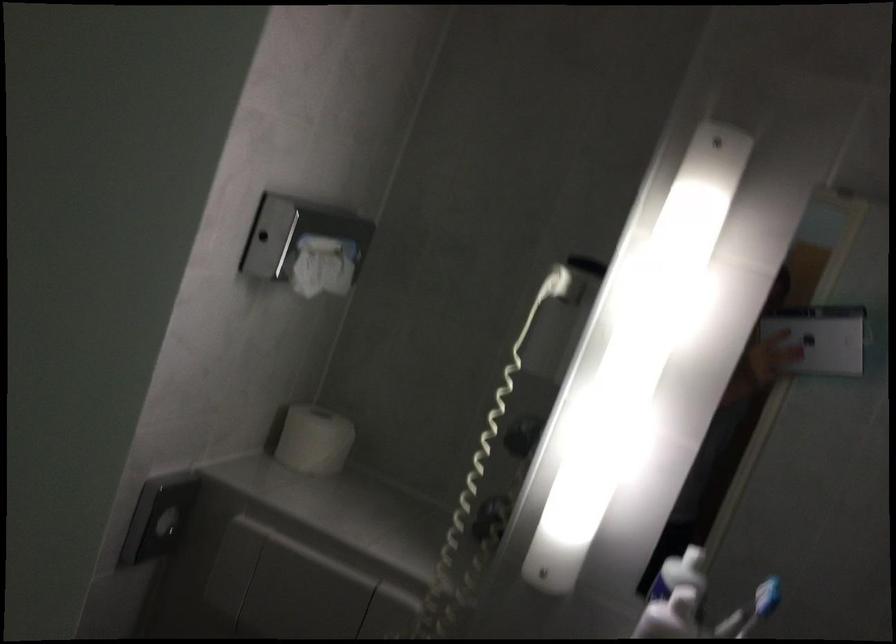
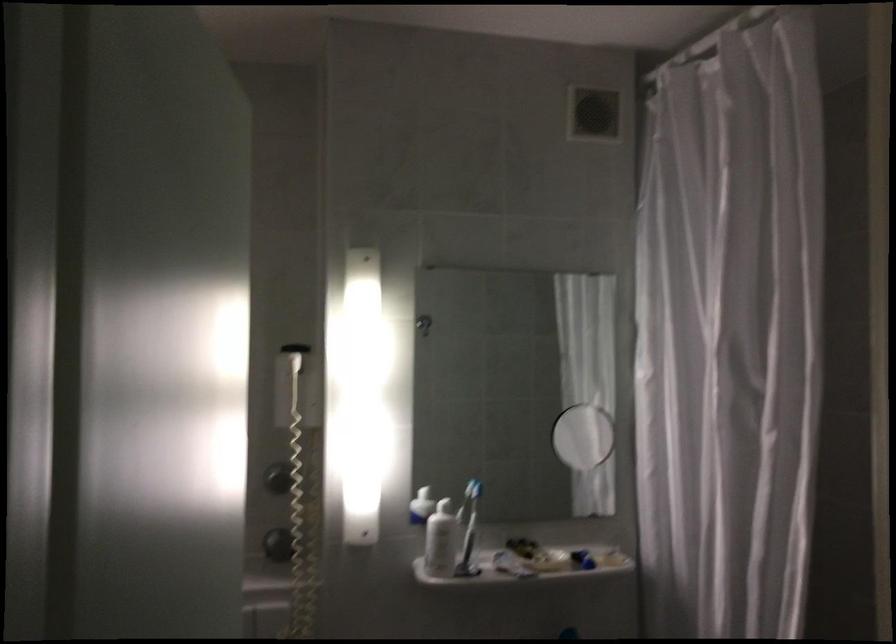
Find the pixel in the second image that matches the point at 556,325 in the first image.

(293, 384)